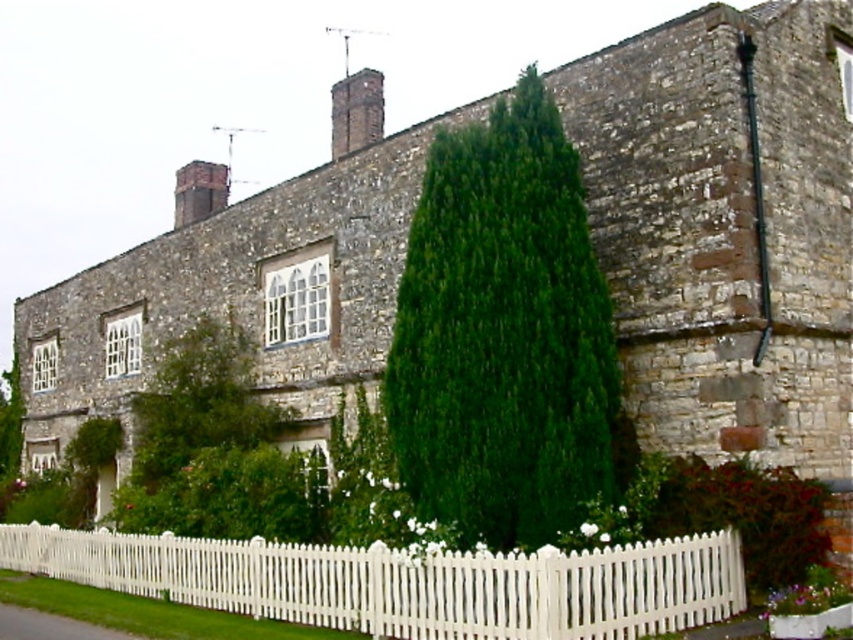
Does point (624, 554) come in front of point (200, 202)?

Yes, point (624, 554) is in front of point (200, 202).

Is point (509, 604) in front of point (228, 192)?

Yes, point (509, 604) is in front of point (228, 192).

At what (x,y) coordinates should I click in order to perform the action: click on white picket fence at lower center. Please return your answer as a coordinate pair (x, y). This screenshot has height=640, width=853. Looking at the image, I should click on (407, 582).

Locate an element on the screen. This screenshot has height=640, width=853. green leafy tree at center is located at coordinates [x=503, y=333].

Is point (399, 369) in front of point (633, 573)?

No, it is behind (633, 573).

Identify the location of green leafy tree at center. This screenshot has width=853, height=640. (503, 333).

Who is shorter, green leafy tree at center or brick chimney at upper center?

green leafy tree at center

What do you see at coordinates (503, 333) in the screenshot? The image size is (853, 640). I see `green leafy tree at center` at bounding box center [503, 333].

Who is more forward, [432,492] or [344,92]?

Point [432,492] is more forward.

The image size is (853, 640). Find the location of `green leafy tree at center`. green leafy tree at center is located at coordinates (503, 333).